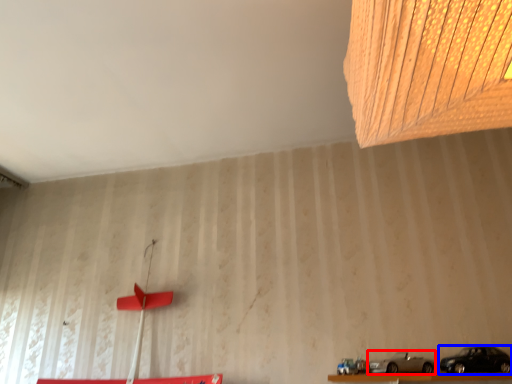
Question: Which object appears farthest to the camera in this image, car (highlighted by a red box) or car (highlighted by a blue box)?

Choices:
 (A) car
 (B) car

Answer: (A)